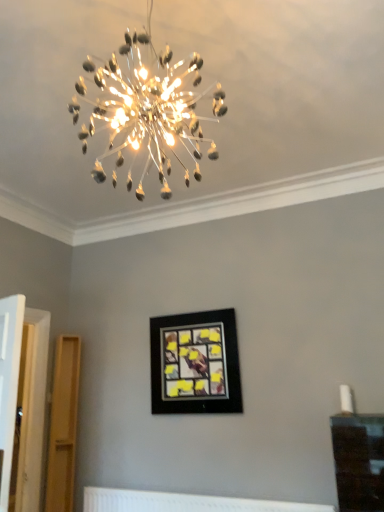
Question: Is clear glass chandelier at upper center not inside white textured radiator at lower center?

Choices:
 (A) yes
 (B) no

Answer: (A)

Question: Considering the relative positions of clear glass chandelier at upper center and white textured radiator at lower center in the image provided, is clear glass chandelier at upper center behind white textured radiator at lower center?

Choices:
 (A) no
 (B) yes

Answer: (A)

Question: Could you tell me if clear glass chandelier at upper center is facing white textured radiator at lower center?

Choices:
 (A) yes
 (B) no

Answer: (B)

Question: From a real-world perspective, is clear glass chandelier at upper center beneath white textured radiator at lower center?

Choices:
 (A) yes
 (B) no

Answer: (B)

Question: From a real-world perspective, is clear glass chandelier at upper center on top of white textured radiator at lower center?

Choices:
 (A) no
 (B) yes

Answer: (B)

Question: From the image's perspective, relative to white textured radiator at lower center, is black matte picture frame at center above or below?

Choices:
 (A) above
 (B) below

Answer: (A)

Question: Does point (175, 332) appear closer or farther from the camera than point (289, 503)?

Choices:
 (A) farther
 (B) closer

Answer: (A)

Question: Which is correct: black matte picture frame at center is inside white textured radiator at lower center, or outside of it?

Choices:
 (A) outside
 (B) inside

Answer: (A)

Question: From a real-world perspective, relative to white textured radiator at lower center, is black matte picture frame at center vertically above or below?

Choices:
 (A) above
 (B) below

Answer: (A)

Question: From the image's perspective, is black matte picture frame at center positioned above or below clear glass chandelier at upper center?

Choices:
 (A) below
 (B) above

Answer: (A)

Question: Considering the positions of black matte picture frame at center and clear glass chandelier at upper center in the image, is black matte picture frame at center bigger or smaller than clear glass chandelier at upper center?

Choices:
 (A) big
 (B) small

Answer: (B)

Question: In terms of height, does black matte picture frame at center look taller or shorter compared to clear glass chandelier at upper center?

Choices:
 (A) short
 (B) tall

Answer: (A)

Question: Is black matte picture frame at center in front of or behind clear glass chandelier at upper center in the image?

Choices:
 (A) behind
 (B) front

Answer: (A)

Question: In terms of size, does white textured radiator at lower center appear bigger or smaller than black matte picture frame at center?

Choices:
 (A) big
 (B) small

Answer: (B)

Question: Is white textured radiator at lower center to the left or to the right of black matte picture frame at center in the image?

Choices:
 (A) right
 (B) left

Answer: (A)